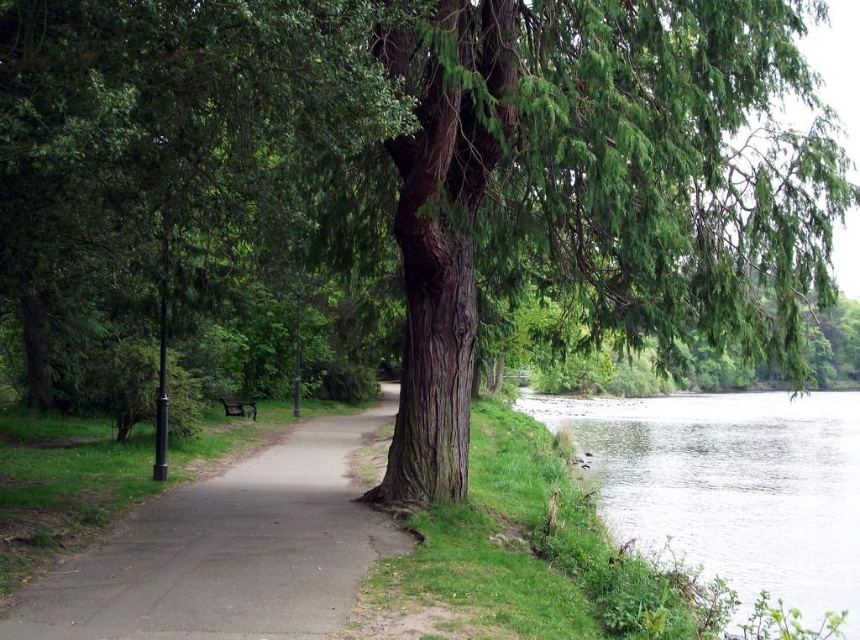
Does green grassy river at lower right have a larger size compared to dark brown wooden bench at center?

Indeed, green grassy river at lower right has a larger size compared to dark brown wooden bench at center.

Locate an element on the screen. green grassy river at lower right is located at coordinates (731, 484).

Does smooth asphalt path at center have a greater width compared to green grassy river at lower right?

In fact, smooth asphalt path at center might be narrower than green grassy river at lower right.

From the picture: Can you confirm if smooth asphalt path at center is positioned below green grassy river at lower right?

No.

Does point (244, 522) come behind point (680, 508)?

No, (244, 522) is closer to viewer.

Locate an element on the screen. smooth asphalt path at center is located at coordinates (226, 550).

Does point (249, 604) come behind point (244, 406)?

No, it is in front of (244, 406).

Is point (145, 612) positioned after point (250, 408)?

That is False.

Identify the location of smooth asphalt path at center. Image resolution: width=860 pixels, height=640 pixels. (226, 550).